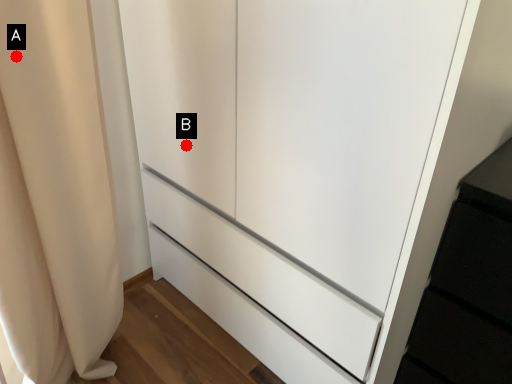
Question: Two points are circled on the image, labeled by A and B beside each circle. Which point appears closest to the camera in this image?

Choices:
 (A) A is closer
 (B) B is closer

Answer: (A)